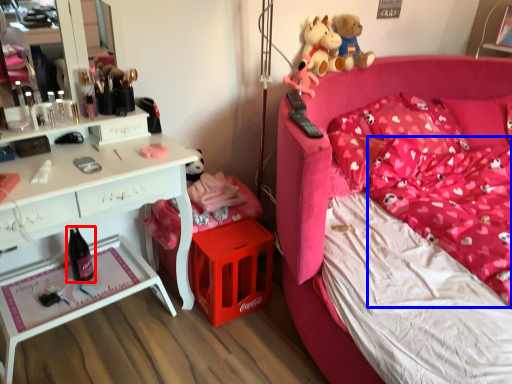
Question: Which object is closer to the camera taking this photo, wine bottle (highlighted by a red box) or mattress (highlighted by a blue box)?

Choices:
 (A) wine bottle
 (B) mattress

Answer: (B)